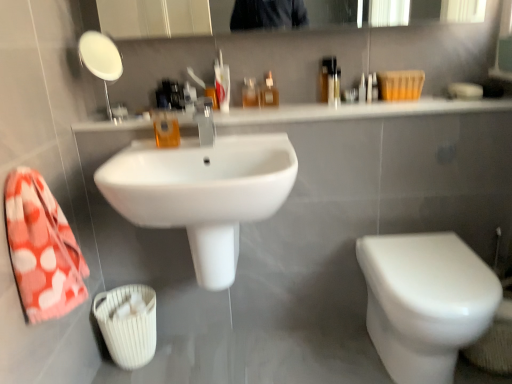
I want to click on free region on the left part of white glossy toilet at lower right, so click(x=314, y=354).